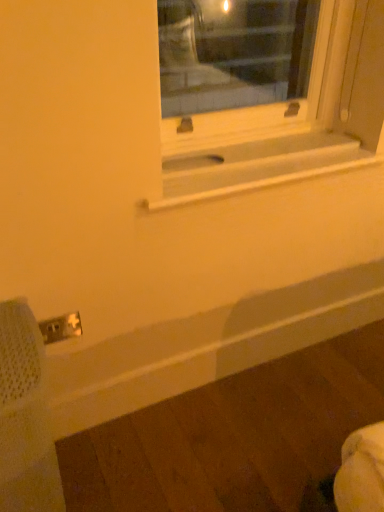
Question: Is white plastic electric outlet at lower left at the back of white matte window sill at center?

Choices:
 (A) yes
 (B) no

Answer: (B)

Question: From the image's perspective, does white matte window sill at center appear higher than white plastic electric outlet at lower left?

Choices:
 (A) no
 (B) yes

Answer: (B)

Question: Is white matte window sill at center in contact with white plastic electric outlet at lower left?

Choices:
 (A) yes
 (B) no

Answer: (B)

Question: Is white matte window sill at center taller than white plastic electric outlet at lower left?

Choices:
 (A) yes
 (B) no

Answer: (B)

Question: Are white matte window sill at center and white plastic electric outlet at lower left located far from each other?

Choices:
 (A) yes
 (B) no

Answer: (B)

Question: From the image's perspective, is white matte window sill at center positioned above or below white plastic electric outlet at lower left?

Choices:
 (A) below
 (B) above

Answer: (B)

Question: Considering the positions of point (314, 144) and point (66, 331), is point (314, 144) closer or farther from the camera than point (66, 331)?

Choices:
 (A) farther
 (B) closer

Answer: (A)

Question: Based on their positions, is white matte window sill at center located to the left or right of white plastic electric outlet at lower left?

Choices:
 (A) left
 (B) right

Answer: (B)

Question: Is white matte window sill at center situated inside white plastic electric outlet at lower left or outside?

Choices:
 (A) outside
 (B) inside

Answer: (A)

Question: Is point (236, 159) positioned closer to the camera than point (9, 439)?

Choices:
 (A) farther
 (B) closer

Answer: (A)

Question: From a real-world perspective, is white matte window sill at center physically located above or below metal mesh swivel chair at lower left?

Choices:
 (A) above
 (B) below

Answer: (A)

Question: Is white matte window sill at center spatially inside metal mesh swivel chair at lower left, or outside of it?

Choices:
 (A) outside
 (B) inside

Answer: (A)

Question: In terms of height, does white matte window sill at center look taller or shorter compared to metal mesh swivel chair at lower left?

Choices:
 (A) tall
 (B) short

Answer: (B)

Question: From their relative heights in the image, would you say metal mesh swivel chair at lower left is taller or shorter than white plastic electric outlet at lower left?

Choices:
 (A) tall
 (B) short

Answer: (A)

Question: Is metal mesh swivel chair at lower left to the left or to the right of white plastic electric outlet at lower left in the image?

Choices:
 (A) right
 (B) left

Answer: (B)